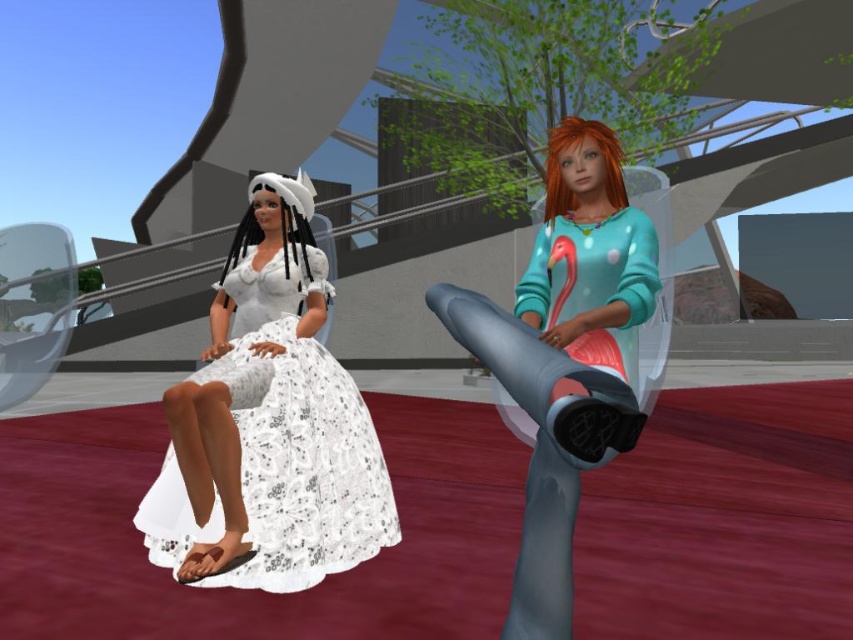
Who is more distant from viewer, (222, 348) or (573, 189)?

The point (222, 348) is more distant.

You are a GUI agent. You are given a task and a screenshot of the screen. Output one action in this format:
    pyautogui.click(x=<x>, y=<y>)
    Task: Click on the white lace dress at left
    The height and width of the screenshot is (640, 853).
    Given the screenshot: What is the action you would take?
    pyautogui.click(x=268, y=424)